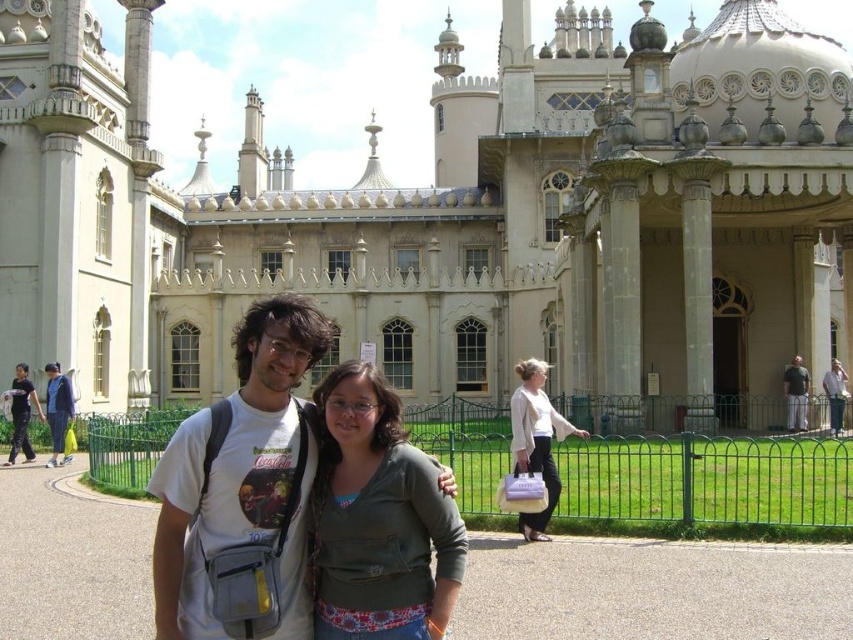
Question: Does white cotton sweater at center have a larger size compared to dark gray shirt at right?

Choices:
 (A) no
 (B) yes

Answer: (B)

Question: Which of these objects is positioned farthest from the white cotton t-shirt at center?

Choices:
 (A) denim jacket at left
 (B) white cotton sweater at center

Answer: (A)

Question: In this image, where is white stone palace at center located relative to matte green sweater at center?

Choices:
 (A) right
 (B) left

Answer: (B)

Question: Which object is closer to the camera taking this photo?

Choices:
 (A) matte green sweater at center
 (B) denim jacket at left

Answer: (A)

Question: Which of the following is the closest to the observer?

Choices:
 (A) white cotton t-shirt at center
 (B) white stone palace at center
 (C) matte white t-shirt at left

Answer: (A)

Question: Does white stone palace at center have a greater width compared to dark gray shirt at right?

Choices:
 (A) no
 (B) yes

Answer: (B)